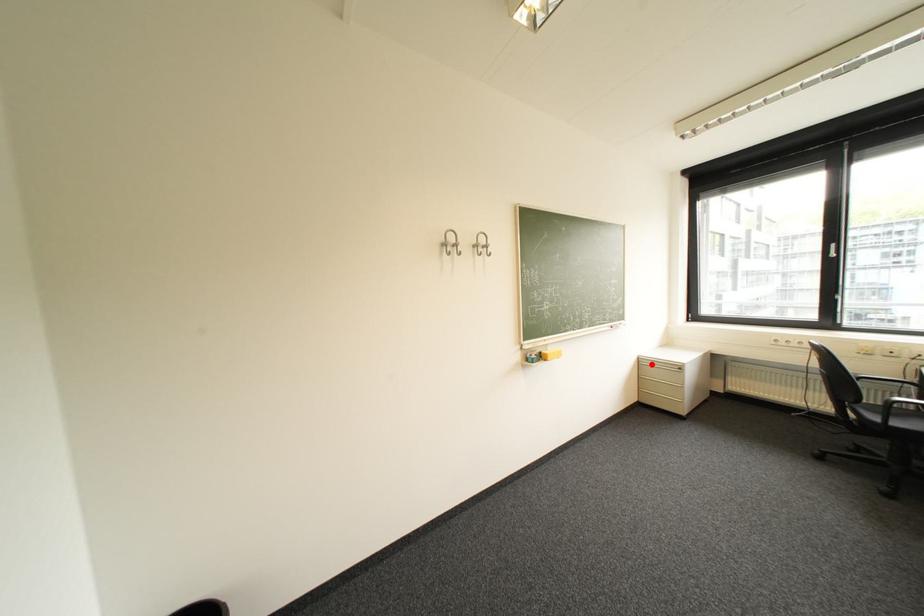
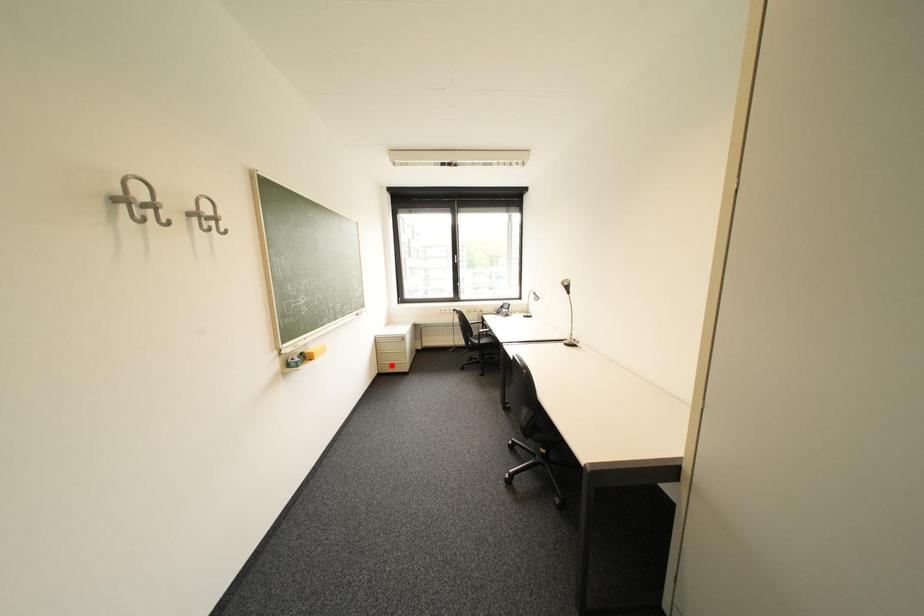
I am providing you with two images of the same scene from different viewpoints. A red point is marked on the first image and another point is marked on the second image. Does the point marked in image1 correspond to the same location as the one in image2?

No